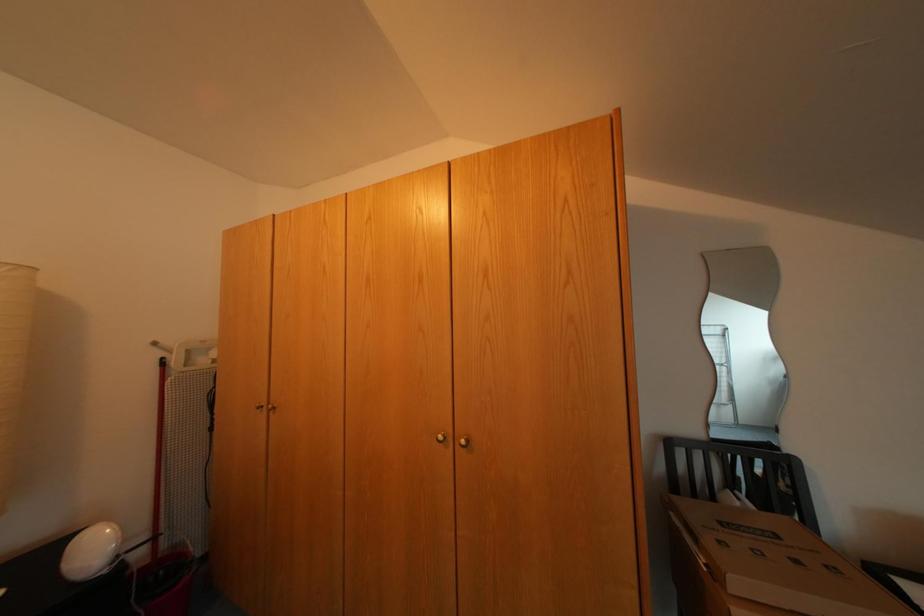
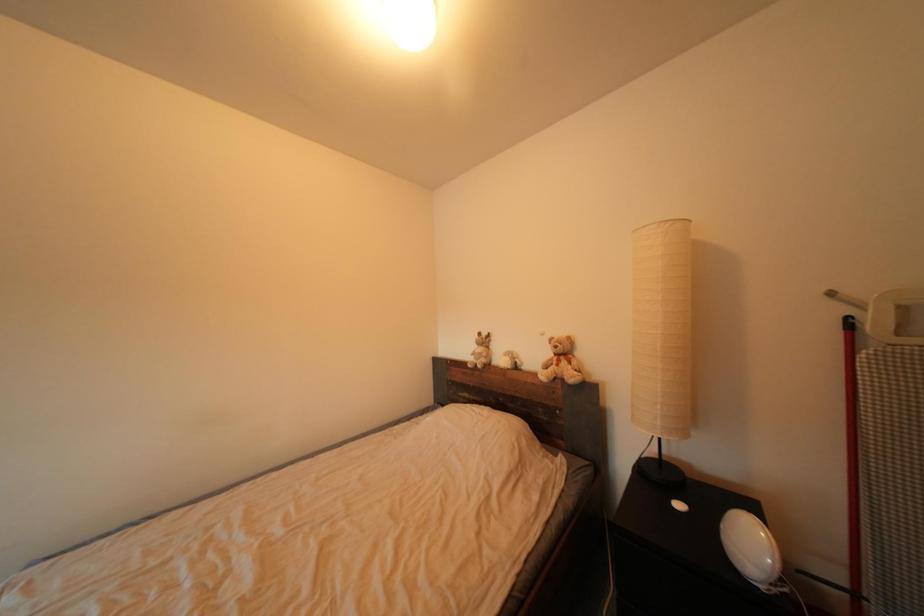
Question: The camera is either moving clockwise (left) or counter-clockwise (right) around the object. The first image is from the beginning of the video and the second image is from the end. Is the camera moving left or right when shooting the video?

Choices:
 (A) Left
 (B) Right

Answer: (B)